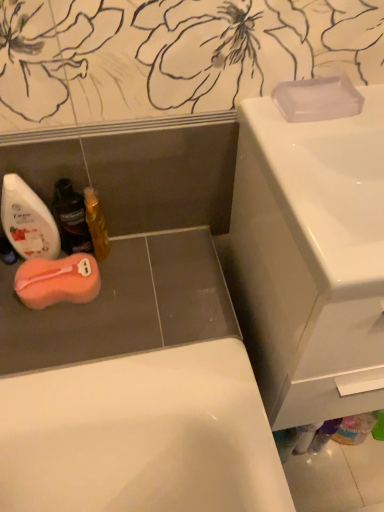
Where is `translucent plastic mouthwash at lower left, the 3th mouthwash positioned from the right`? translucent plastic mouthwash at lower left, the 3th mouthwash positioned from the right is located at coordinates [x=28, y=221].

Measure the distance between translucent plastic mouthwash at lower left, the 2th mouthwash positioned from the right, and camera.

The distance of translucent plastic mouthwash at lower left, the 2th mouthwash positioned from the right, from camera is 31.43 inches.

Locate an element on the screen. shiny gold bottle at lower left, marked as the third mouthwash in a left-to-right arrangement is located at coordinates (96, 224).

Image resolution: width=384 pixels, height=512 pixels. What do you see at coordinates (311, 259) in the screenshot? I see `white glossy sink at upper right` at bounding box center [311, 259].

What is the approximate height of transparent plastic soap at upper right, which is the second soap in back-to-front order?

The height of transparent plastic soap at upper right, which is the second soap in back-to-front order, is 0.94 inches.

In order to face transparent plastic soap at upper right, positioned as the 1th soap in front-to-back order, should I rotate leftwards or rightwards?

Rotate right and turn 16.204 degrees.

The height and width of the screenshot is (512, 384). Identify the location of translucent plastic mouthwash at lower left, the 3th mouthwash positioned from the right. (28, 221).

Considering the points (305, 82) and (64, 201), which point is in front, point (305, 82) or point (64, 201)?

The point (305, 82) is closer to the camera.

Who is shorter, transparent plastic soap at upper right, placed as the 2th soap when sorted from bottom to top, or translucent plastic mouthwash at lower left, the 2th mouthwash positioned from the right?

Standing shorter between the two is transparent plastic soap at upper right, placed as the 2th soap when sorted from bottom to top.

Can we say transparent plastic soap at upper right, placed as the 2th soap when sorted from left to right, lies outside translucent plastic mouthwash at lower left, the 2th mouthwash positioned from the right?

transparent plastic soap at upper right, placed as the 2th soap when sorted from left to right, lies outside translucent plastic mouthwash at lower left, the 2th mouthwash positioned from the right,'s area.

How many degrees apart are the facing directions of white glossy sink at upper right and pink sponge at lower left, placed as the 1th soap when sorted from left to right?

white glossy sink at upper right and pink sponge at lower left, placed as the 1th soap when sorted from left to right, are facing 0.142 degrees away from each other.

Which object is more forward, white glossy sink at upper right or pink sponge at lower left, which is the first soap from bottom to top?

white glossy sink at upper right.

From a real-world perspective, which object stands above the other?

From a 3D spatial view, white glossy sink at upper right is above.

Would you say white glossy sink at upper right is a long distance from pink sponge at lower left, placed as the 1th soap when sorted from left to right?

No, there isn't a large distance between white glossy sink at upper right and pink sponge at lower left, placed as the 1th soap when sorted from left to right.

Is translucent plastic mouthwash at lower left, the 2th mouthwash positioned from the right, oriented away from translucent plastic mouthwash at lower left, positioned as the 1th mouthwash in left-to-right order?

No, translucent plastic mouthwash at lower left, positioned as the 1th mouthwash in left-to-right order, is not at the back of translucent plastic mouthwash at lower left, the 2th mouthwash positioned from the right.

Can you confirm if translucent plastic mouthwash at lower left, the 2th mouthwash positioned from the right, is shorter than translucent plastic mouthwash at lower left, the 3th mouthwash positioned from the right?

Yes, translucent plastic mouthwash at lower left, the 2th mouthwash positioned from the right, is shorter than translucent plastic mouthwash at lower left, the 3th mouthwash positioned from the right.

From the image's perspective, relative to translucent plastic mouthwash at lower left, positioned as the 1th mouthwash in left-to-right order, is translucent plastic mouthwash at lower left, arranged as the second mouthwash when viewed from the left, above or below?

Clearly, from the image's perspective, translucent plastic mouthwash at lower left, arranged as the second mouthwash when viewed from the left, is below translucent plastic mouthwash at lower left, positioned as the 1th mouthwash in left-to-right order.

Looking at this image, looking at the image, does translucent plastic mouthwash at lower left, the 2th mouthwash positioned from the right, seem bigger or smaller compared to translucent plastic mouthwash at lower left, the 3th mouthwash positioned from the right?

Clearly, translucent plastic mouthwash at lower left, the 2th mouthwash positioned from the right, is smaller in size than translucent plastic mouthwash at lower left, the 3th mouthwash positioned from the right.

Considering the sizes of objects transparent plastic soap at upper right, positioned as the 1th soap in front-to-back order, and pink sponge at lower left, the 2th soap viewed from the front, in the image provided, who is wider, transparent plastic soap at upper right, positioned as the 1th soap in front-to-back order, or pink sponge at lower left, the 2th soap viewed from the front,?

pink sponge at lower left, the 2th soap viewed from the front, is wider.

From a real-world perspective, is transparent plastic soap at upper right, placed as the 2th soap when sorted from left to right, positioned above or below pink sponge at lower left, which is the first soap from bottom to top?

transparent plastic soap at upper right, placed as the 2th soap when sorted from left to right, is above pink sponge at lower left, which is the first soap from bottom to top.

Does transparent plastic soap at upper right, which is the second soap in back-to-front order, have a greater height compared to pink sponge at lower left, positioned as the 2th soap in top-to-bottom order?

In fact, transparent plastic soap at upper right, which is the second soap in back-to-front order, may be shorter than pink sponge at lower left, positioned as the 2th soap in top-to-bottom order.

Looking at this image, from a real-world perspective, is shiny gold bottle at lower left, marked as the third mouthwash in a left-to-right arrangement, physically below translucent plastic mouthwash at lower left, the 3th mouthwash positioned from the right?

Yes, from a real-world perspective, shiny gold bottle at lower left, marked as the third mouthwash in a left-to-right arrangement, is under translucent plastic mouthwash at lower left, the 3th mouthwash positioned from the right.

Locate an element on the screen. The image size is (384, 512). the 2nd mouthwash positioned below the translucent plastic mouthwash at lower left, positioned as the 1th mouthwash in left-to-right order (from a real-world perspective) is located at coordinates (96, 224).

Measure the distance from shiny gold bottle at lower left, marked as the third mouthwash in a left-to-right arrangement, to translucent plastic mouthwash at lower left, the 3th mouthwash positioned from the right.

shiny gold bottle at lower left, marked as the third mouthwash in a left-to-right arrangement, is 10.78 centimeters away from translucent plastic mouthwash at lower left, the 3th mouthwash positioned from the right.

In the image, is shiny gold bottle at lower left, the 1th mouthwash in the right-to-left sequence, positioned in front of or behind translucent plastic mouthwash at lower left, the 3th mouthwash positioned from the right?

shiny gold bottle at lower left, the 1th mouthwash in the right-to-left sequence, is behind translucent plastic mouthwash at lower left, the 3th mouthwash positioned from the right.

This screenshot has width=384, height=512. Find the location of `soap in front of the translucent plastic mouthwash at lower left, arranged as the second mouthwash when viewed from the left`. soap in front of the translucent plastic mouthwash at lower left, arranged as the second mouthwash when viewed from the left is located at coordinates (318, 99).

Would you say translucent plastic mouthwash at lower left, the 2th mouthwash positioned from the right, contains transparent plastic soap at upper right, which is the first soap in top-to-bottom order?

No.

Considering the relative positions of translucent plastic mouthwash at lower left, the 2th mouthwash positioned from the right, and transparent plastic soap at upper right, positioned as the 1th soap in front-to-back order, in the image provided, is translucent plastic mouthwash at lower left, the 2th mouthwash positioned from the right, to the left or to the right of transparent plastic soap at upper right, positioned as the 1th soap in front-to-back order,?

In the image, translucent plastic mouthwash at lower left, the 2th mouthwash positioned from the right, appears on the left side of transparent plastic soap at upper right, positioned as the 1th soap in front-to-back order.

Considering the positions of point (84, 261) and point (342, 106), is point (84, 261) closer or farther from the camera than point (342, 106)?

Point (84, 261) is farther from the camera than point (342, 106).

Can you tell me how much pink sponge at lower left, which is the first soap from bottom to top, and transparent plastic soap at upper right, positioned as the 1th soap in front-to-back order, differ in facing direction?

There is a 0.143-degree angle between the facing directions of pink sponge at lower left, which is the first soap from bottom to top, and transparent plastic soap at upper right, positioned as the 1th soap in front-to-back order.

Is pink sponge at lower left, which is counted as the first soap, starting from the back, at the left side of transparent plastic soap at upper right, placed as the 2th soap when sorted from left to right?

Yes.

Who is shorter, pink sponge at lower left, which ranks as the second soap in right-to-left order, or transparent plastic soap at upper right, placed as the 2th soap when sorted from left to right?

Standing shorter between the two is transparent plastic soap at upper right, placed as the 2th soap when sorted from left to right.

At what (x,y) coordinates should I click in order to perform the action: click on the 2nd mouthwash below when counting from the transparent plastic soap at upper right, which is the 1th soap from right to left (from the image's perspective). Please return your answer as a coordinate pair (x, y). This screenshot has height=512, width=384. Looking at the image, I should click on (x=71, y=218).

Locate an element on the screen. The width and height of the screenshot is (384, 512). sink above the pink sponge at lower left, the 2th soap viewed from the front (from a real-world perspective) is located at coordinates (311, 259).

Based on their spatial positions, is translucent plastic mouthwash at lower left, arranged as the second mouthwash when viewed from the left, or transparent plastic soap at upper right, which is the 1th soap from right to left, further from pink sponge at lower left, which is the first soap from bottom to top?

Among the two, transparent plastic soap at upper right, which is the 1th soap from right to left, is located further to pink sponge at lower left, which is the first soap from bottom to top.

Considering their positions, is white glossy sink at upper right positioned closer to shiny gold bottle at lower left, the 1th mouthwash in the right-to-left sequence, than translucent plastic mouthwash at lower left, arranged as the second mouthwash when viewed from the left?

Among the two, translucent plastic mouthwash at lower left, arranged as the second mouthwash when viewed from the left, is located nearer to shiny gold bottle at lower left, the 1th mouthwash in the right-to-left sequence.

From the image, which object appears to be nearer to translucent plastic mouthwash at lower left, arranged as the second mouthwash when viewed from the left, pink sponge at lower left, which ranks as the second soap in right-to-left order, or shiny gold bottle at lower left, marked as the third mouthwash in a left-to-right arrangement?

Among the two, shiny gold bottle at lower left, marked as the third mouthwash in a left-to-right arrangement, is located nearer to translucent plastic mouthwash at lower left, arranged as the second mouthwash when viewed from the left.

When comparing their distances from transparent plastic soap at upper right, which is the 1th soap from right to left, does translucent plastic mouthwash at lower left, arranged as the second mouthwash when viewed from the left, or white glossy sink at upper right seem further?

Based on the image, translucent plastic mouthwash at lower left, arranged as the second mouthwash when viewed from the left, appears to be further to transparent plastic soap at upper right, which is the 1th soap from right to left.

Considering their positions, is pink sponge at lower left, the 2th soap viewed from the front, positioned further to white glossy sink at upper right than transparent plastic soap at upper right, placed as the 2th soap when sorted from bottom to top?

Among the two, pink sponge at lower left, the 2th soap viewed from the front, is located further to white glossy sink at upper right.

Which object lies nearer to the anchor point transparent plastic soap at upper right, which is the second soap in back-to-front order, pink sponge at lower left, which is the first soap from bottom to top, or shiny gold bottle at lower left, the 1th mouthwash in the right-to-left sequence?

shiny gold bottle at lower left, the 1th mouthwash in the right-to-left sequence.

From the picture: Looking at the image, which one is located closer to white glossy sink at upper right, pink sponge at lower left, positioned as the 2th soap in top-to-bottom order, or translucent plastic mouthwash at lower left, positioned as the 1th mouthwash in left-to-right order?

Among the two, pink sponge at lower left, positioned as the 2th soap in top-to-bottom order, is located nearer to white glossy sink at upper right.

From the image, which object appears to be nearer to translucent plastic mouthwash at lower left, the 3th mouthwash positioned from the right, translucent plastic mouthwash at lower left, the 2th mouthwash positioned from the right, or transparent plastic soap at upper right, placed as the 2th soap when sorted from bottom to top?

translucent plastic mouthwash at lower left, the 2th mouthwash positioned from the right, lies closer to translucent plastic mouthwash at lower left, the 3th mouthwash positioned from the right, than the other object.

Locate an element on the screen. The width and height of the screenshot is (384, 512). mouthwash between translucent plastic mouthwash at lower left, arranged as the second mouthwash when viewed from the left, and transparent plastic soap at upper right, positioned as the 1th soap in front-to-back order, from left to right is located at coordinates (96, 224).

The width and height of the screenshot is (384, 512). What are the coordinates of `soap between translucent plastic mouthwash at lower left, the 3th mouthwash positioned from the right, and transparent plastic soap at upper right, positioned as the 1th soap in front-to-back order` in the screenshot? It's located at (57, 281).

Where is `soap located between pink sponge at lower left, which is counted as the first soap, starting from the back, and white glossy sink at upper right in the left-right direction`? soap located between pink sponge at lower left, which is counted as the first soap, starting from the back, and white glossy sink at upper right in the left-right direction is located at coordinates (318, 99).

Locate an element on the screen. This screenshot has width=384, height=512. soap between translucent plastic mouthwash at lower left, the 2th mouthwash positioned from the right, and white glossy sink at upper right, in the horizontal direction is located at coordinates (318, 99).